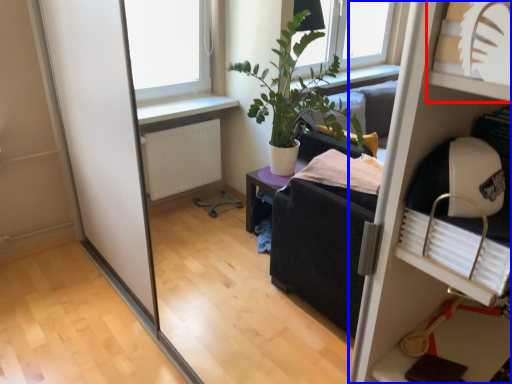
Question: Which object appears closest to the camera in this image, shelf (highlighted by a red box) or shelf (highlighted by a blue box)?

Choices:
 (A) shelf
 (B) shelf

Answer: (A)